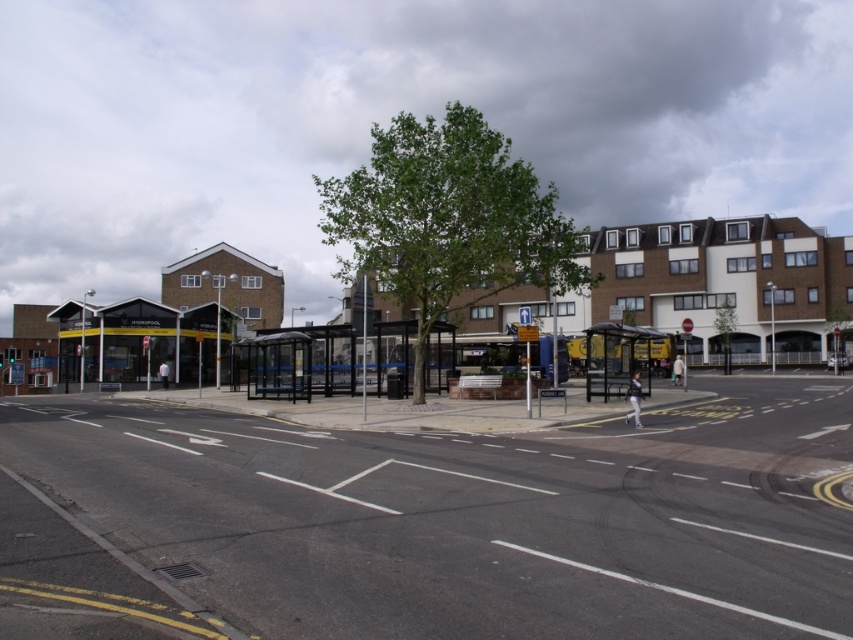
Does black asphalt road at center appear on the left side of black metal bus stop at center?

Correct, you'll find black asphalt road at center to the left of black metal bus stop at center.

Can you confirm if black asphalt road at center is thinner than black metal bus stop at center?

No.

Describe the element at coordinates (474, 518) in the screenshot. I see `black asphalt road at center` at that location.

This screenshot has width=853, height=640. What are the coordinates of `black asphalt road at center` in the screenshot? It's located at (474, 518).